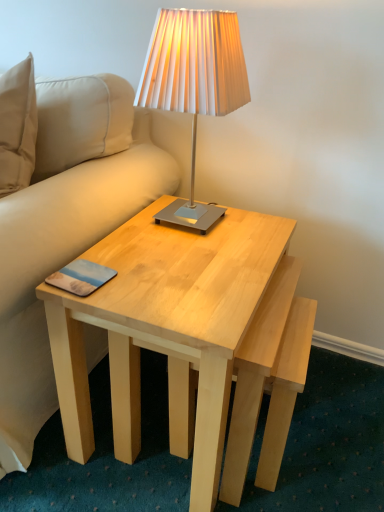
Question: Considering the relative sizes of matte plastic pad at lower left and light wood coffee table at center in the image provided, is matte plastic pad at lower left shorter than light wood coffee table at center?

Choices:
 (A) no
 (B) yes

Answer: (B)

Question: Would you say matte plastic pad at lower left contains light wood coffee table at center?

Choices:
 (A) no
 (B) yes

Answer: (A)

Question: Could you tell me if matte plastic pad at lower left is turned towards light wood coffee table at center?

Choices:
 (A) yes
 (B) no

Answer: (A)

Question: Can you confirm if matte plastic pad at lower left is positioned to the left of light wood coffee table at center?

Choices:
 (A) no
 (B) yes

Answer: (B)

Question: Considering the relative positions of matte plastic pad at lower left and light wood coffee table at center in the image provided, is matte plastic pad at lower left to the right of light wood coffee table at center from the viewer's perspective?

Choices:
 (A) no
 (B) yes

Answer: (A)

Question: Is matte plastic pad at lower left bigger than light wood coffee table at center?

Choices:
 (A) yes
 (B) no

Answer: (B)

Question: Could you tell me if matte silver lamp at upper center is turned towards matte plastic pad at lower left?

Choices:
 (A) yes
 (B) no

Answer: (A)

Question: Can you confirm if matte silver lamp at upper center is wider than matte plastic pad at lower left?

Choices:
 (A) yes
 (B) no

Answer: (A)

Question: Does matte silver lamp at upper center have a lesser height compared to matte plastic pad at lower left?

Choices:
 (A) no
 (B) yes

Answer: (A)

Question: Considering the relative sizes of matte silver lamp at upper center and matte plastic pad at lower left in the image provided, is matte silver lamp at upper center taller than matte plastic pad at lower left?

Choices:
 (A) no
 (B) yes

Answer: (B)

Question: Is matte plastic pad at lower left at the back of matte silver lamp at upper center?

Choices:
 (A) yes
 (B) no

Answer: (B)

Question: Are matte silver lamp at upper center and matte plastic pad at lower left far apart?

Choices:
 (A) no
 (B) yes

Answer: (A)

Question: Is light wood coffee table at center not within matte silver lamp at upper center?

Choices:
 (A) yes
 (B) no

Answer: (A)